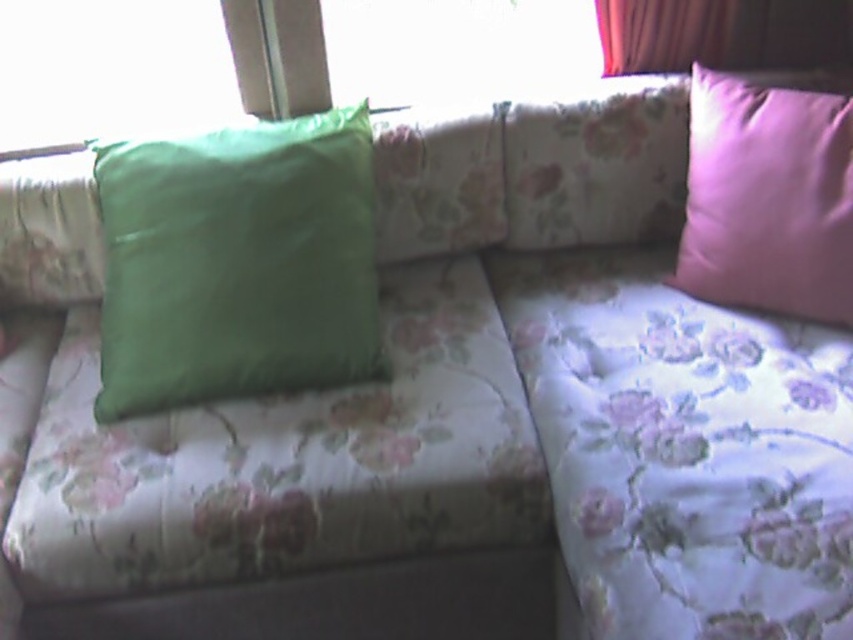
Does green matte pillow at left lie behind transparent glass window at upper left?

No.

Between green matte pillow at left and transparent glass window at upper left, which one has more height?

With more height is green matte pillow at left.

What do you see at coordinates (236, 262) in the screenshot?
I see `green matte pillow at left` at bounding box center [236, 262].

You are a GUI agent. You are given a task and a screenshot of the screen. Output one action in this format:
    pyautogui.click(x=<x>, y=<y>)
    Task: Click on the green matte pillow at left
    This screenshot has height=640, width=853.
    Given the screenshot: What is the action you would take?
    pyautogui.click(x=236, y=262)

Is point (567, 4) closer to camera compared to point (757, 35)?

No, it is not.

Which is above, transparent glass window at upper center or velvet pink curtain at upper right?

velvet pink curtain at upper right is higher up.

Which is behind, point (358, 24) or point (701, 28)?

Point (358, 24)

Locate an element on the screen. The width and height of the screenshot is (853, 640). transparent glass window at upper center is located at coordinates (456, 48).

Does pink satin pillow at right have a lesser height compared to transparent glass window at upper left?

In fact, pink satin pillow at right may be taller than transparent glass window at upper left.

The width and height of the screenshot is (853, 640). Describe the element at coordinates (767, 198) in the screenshot. I see `pink satin pillow at right` at that location.

Locate an element on the screen. The width and height of the screenshot is (853, 640). pink satin pillow at right is located at coordinates (767, 198).